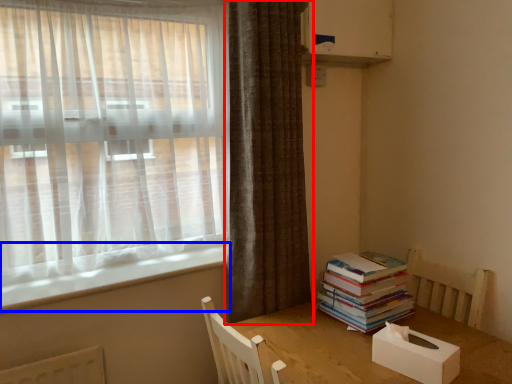
Question: Which of the following is the closest to the observer, curtain (highlighted by a red box) or window sill (highlighted by a blue box)?

Choices:
 (A) curtain
 (B) window sill

Answer: (B)